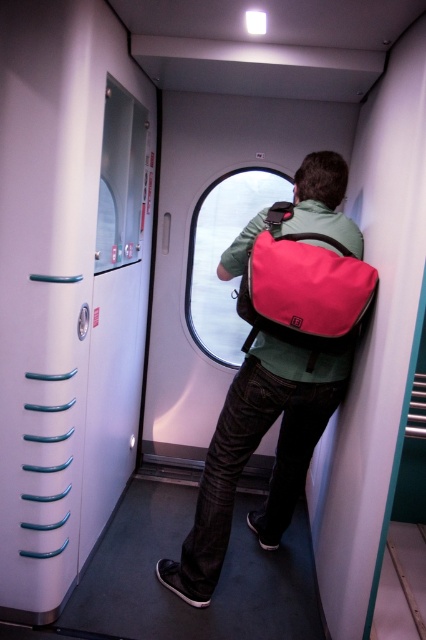
You are a passenger on a moving train and need to exit at the next station. You see a white plastic door at left and a transparent glass window at center. Which object is located lower in the image?

The white plastic door at left is below the transparent glass window at center, so the white plastic door at left is located lower in the image.

You are a passenger on a moving train and need to exit at the next station. You see a white glossy door at left and a matte pink backpack at center. Which object is taller?

The white glossy door at left is much taller than the matte pink backpack at center.